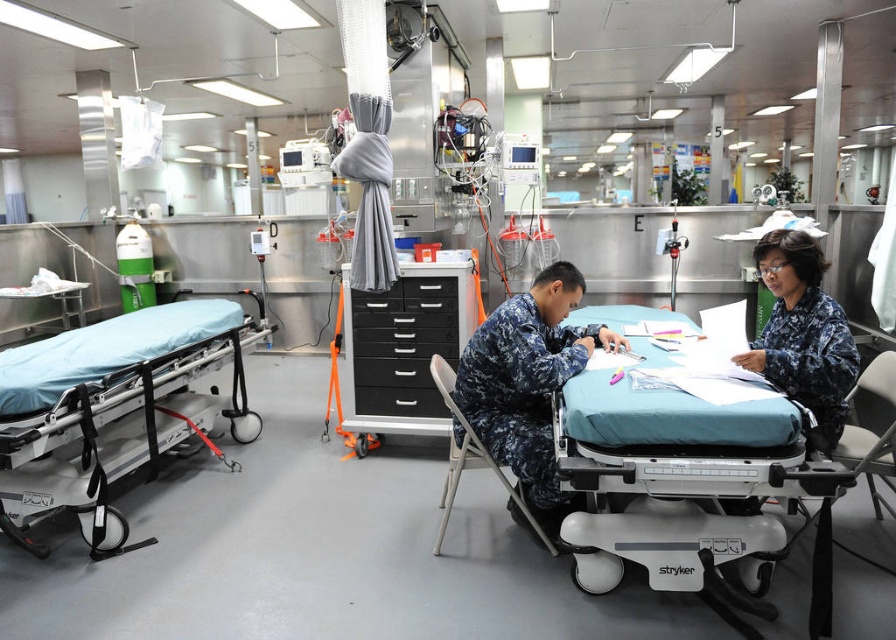
Is point (720, 500) behind point (102, 465)?

No, it is in front of (102, 465).

Measure the distance from teal fabric stretcher at center to blue fabric-covered stretcher at left.

teal fabric stretcher at center is 5.84 feet away from blue fabric-covered stretcher at left.

Find the location of a particular element. teal fabric stretcher at center is located at coordinates tap(685, 497).

Locate an element on the screen. The image size is (896, 640). teal fabric stretcher at center is located at coordinates (685, 497).

Can you confirm if blue fabric-covered stretcher at left is thinner than black plastic drawers at center?

No.

From the picture: Is blue fabric-covered stretcher at left taller than black plastic drawers at center?

Incorrect, blue fabric-covered stretcher at left's height is not larger of black plastic drawers at center's.

Which is in front, point (173, 392) or point (363, 372)?

Point (363, 372) is more forward.

At what (x,y) coordinates should I click in order to perform the action: click on blue fabric-covered stretcher at left. Please return your answer as a coordinate pair (x, y). Looking at the image, I should click on (115, 410).

Which is behind, point (393, 301) or point (849, 365)?

The point (393, 301) is behind.

This screenshot has width=896, height=640. What do you see at coordinates (405, 348) in the screenshot?
I see `black plastic drawers at center` at bounding box center [405, 348].

Where is `black plastic drawers at center`? The width and height of the screenshot is (896, 640). black plastic drawers at center is located at coordinates (405, 348).